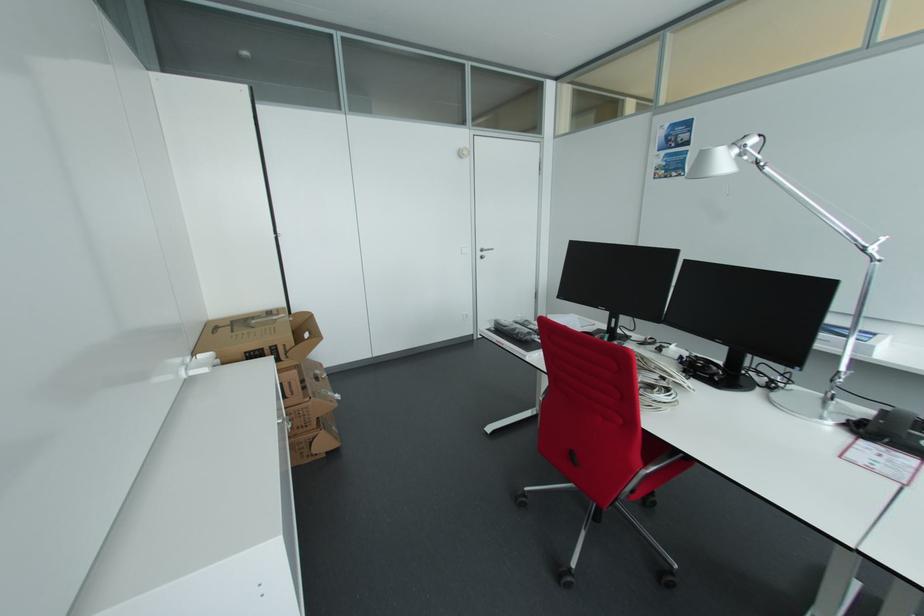
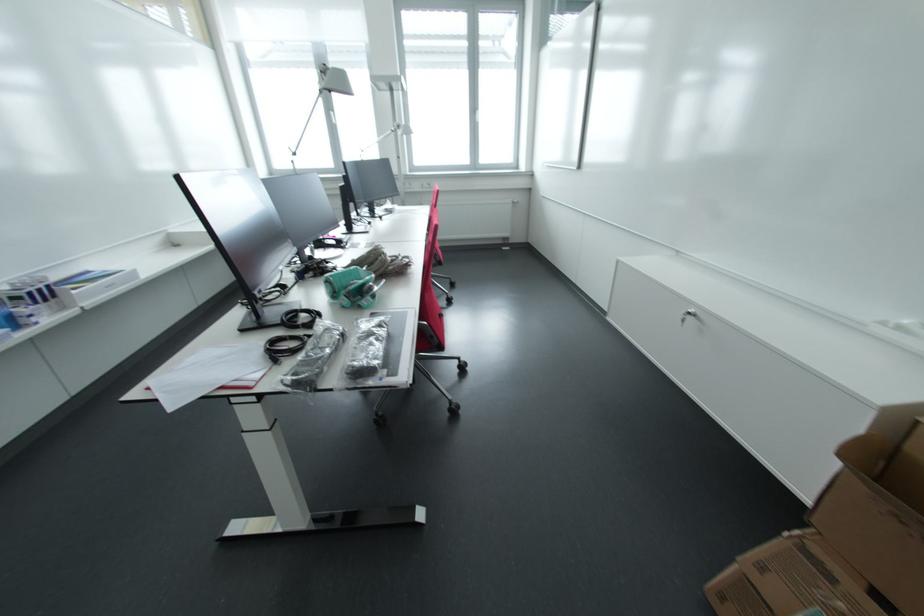
In the second image, find the point that corresponds to (x=317, y=394) in the first image.

(833, 578)